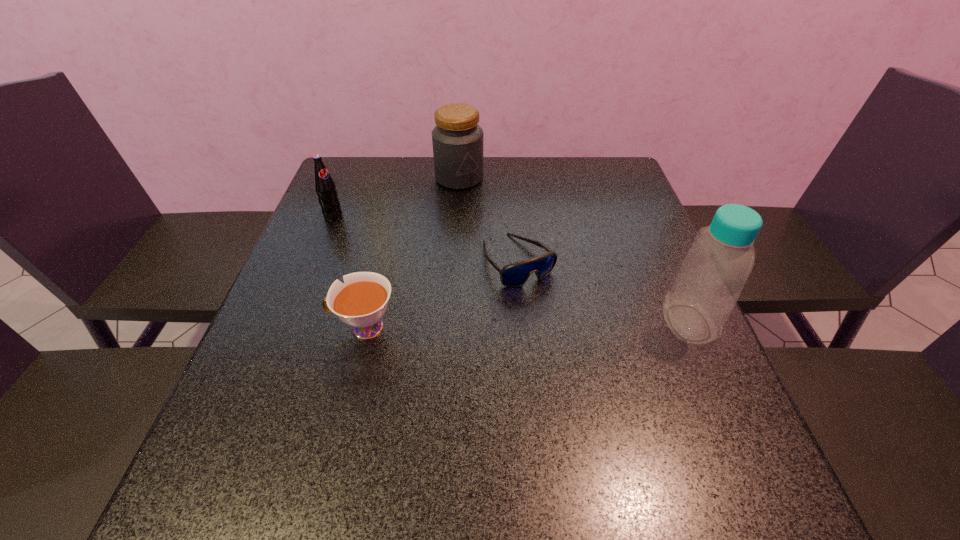
The height and width of the screenshot is (540, 960). I want to click on free space located 0.140m on the side of the teacup with the handle, so click(x=262, y=328).

This screenshot has height=540, width=960. I want to click on free space located on the side of the teacup with the handle, so click(x=262, y=328).

Find the location of `free space located 0.380m on the back of the bottle`. free space located 0.380m on the back of the bottle is located at coordinates (635, 200).

I want to click on vacant space located on the front label of the pop, so click(x=410, y=268).

In order to click on free location located 0.390m on the front label of the pop in this screenshot , I will do `click(444, 291)`.

At what (x,y) coordinates should I click in order to perform the action: click on vacant space located on the front label of the pop. Please return your answer as a coordinate pair (x, y). Looking at the image, I should click on (434, 284).

In order to click on vacant space located on the surface of the jar near the warning symbol in this screenshot , I will do `click(491, 228)`.

At what (x,y) coordinates should I click in order to perform the action: click on free point located on the surface of the jar near the warning symbol. Please return your answer as a coordinate pair (x, y). The image size is (960, 540). Looking at the image, I should click on (502, 247).

At what (x,y) coordinates should I click in order to perform the action: click on free space located on the surface of the jar near the warning symbol. Please return your answer as a coordinate pair (x, y). This screenshot has width=960, height=540. Looking at the image, I should click on (496, 238).

Image resolution: width=960 pixels, height=540 pixels. I want to click on vacant space located 0.240m on the front-facing side of the sunglasses, so click(599, 369).